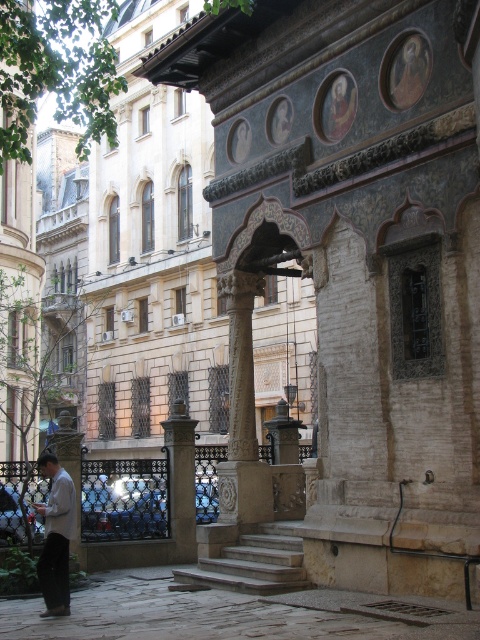
Based on the photo, between light brown leather jacket at lower left and polished stone column at center, which one is positioned higher?

light brown leather jacket at lower left is higher up.

Does light brown leather jacket at lower left have a greater width compared to polished stone column at center?

No, light brown leather jacket at lower left is not wider than polished stone column at center.

Describe the element at coordinates (56, 536) in the screenshot. I see `light brown leather jacket at lower left` at that location.

This screenshot has width=480, height=640. What are the coordinates of `light brown leather jacket at lower left` in the screenshot? It's located at coord(56,536).

Is point (228, 424) closer to viewer compared to point (168, 422)?

No, it is behind (168, 422).

Between point (252, 468) and point (170, 454), which one is positioned behind?

The point (170, 454) is behind.

Between point (229, 308) and point (177, 532), which one is positioned in front?

Point (229, 308) is in front.

Identify the location of white stone column at center. The image size is (480, 640). (242, 412).

Does white stone column at center appear on the right side of light brown leather jacket at lower left?

Yes, white stone column at center is to the right of light brown leather jacket at lower left.

Between point (237, 304) and point (69, 608), which one is positioned in front?

Positioned in front is point (69, 608).

Which is behind, point (247, 381) or point (52, 465)?

Point (247, 381)

The height and width of the screenshot is (640, 480). I want to click on white stone column at center, so click(x=242, y=412).